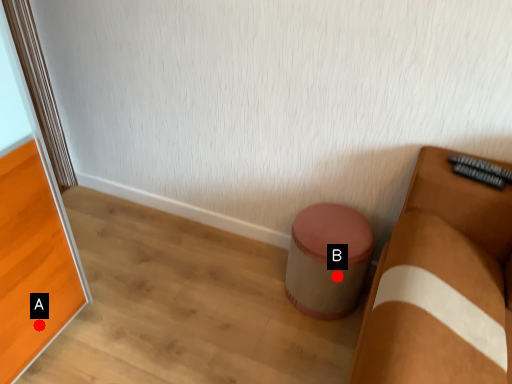
Question: Two points are circled on the image, labeled by A and B beside each circle. Among these points, which one is nearest to the camera?

Choices:
 (A) A is closer
 (B) B is closer

Answer: (A)